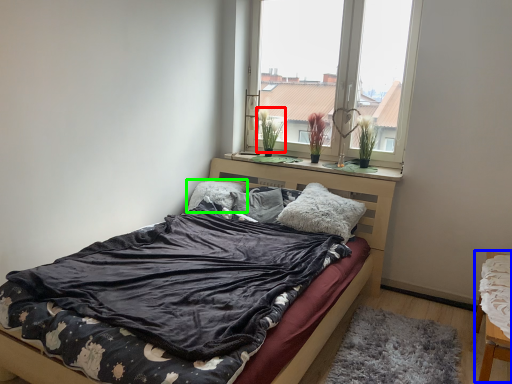
Question: Which object is the closest to the plant (highlighted by a red box)? Choose among these: chair (highlighted by a blue box) or pillow (highlighted by a green box).

Choices:
 (A) chair
 (B) pillow

Answer: (B)